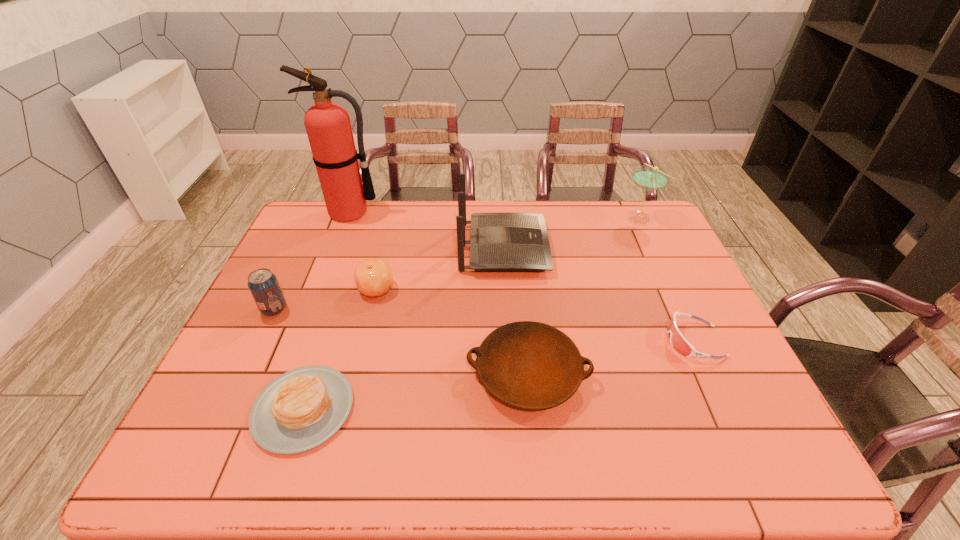
Locate an element on the screen. vacant space that satisfies the following two spatial constraints: 1. at the nozzle of the tallest object; 2. on the front-facing side of the router is located at coordinates (336, 248).

Find the location of a particular element. This screenshot has width=960, height=540. vacant region that satisfies the following two spatial constraints: 1. at the nozzle of the fire extinguisher; 2. on the left side of the pancake is located at coordinates (274, 409).